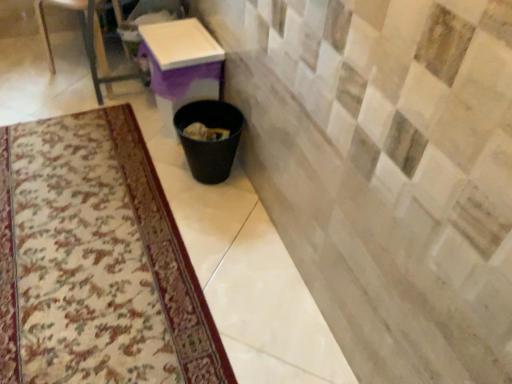
The image size is (512, 384). In order to click on free space that is to the left of black plastic trash can at lower center in this screenshot , I will do `click(151, 169)`.